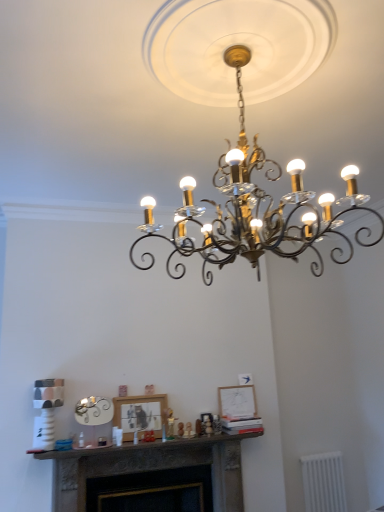
Locate an element on the screen. This screenshot has width=384, height=512. black wrought iron chandelier at center is located at coordinates (252, 206).

This screenshot has width=384, height=512. Describe the element at coordinates (323, 482) in the screenshot. I see `white plastic radiator at lower right` at that location.

What do you see at coordinates (151, 476) in the screenshot? Image resolution: width=384 pixels, height=512 pixels. I see `dark gray stone fireplace at center` at bounding box center [151, 476].

The image size is (384, 512). I want to click on black wrought iron chandelier at center, so click(x=252, y=206).

Is matte white picture frame at center, which ranks as the 2th picture frame in front-to-back order, wider than matte black picture frame at center, marked as the 1th picture frame in a front-to-back arrangement?

In fact, matte white picture frame at center, which ranks as the 2th picture frame in front-to-back order, might be narrower than matte black picture frame at center, marked as the 1th picture frame in a front-to-back arrangement.

Between point (246, 401) and point (150, 415), which one is positioned behind?

The point (246, 401) is farther from the camera.

Could you tell me if matte white picture frame at center, which ranks as the 2th picture frame in front-to-back order, is turned towards matte black picture frame at center, positioned as the second picture frame in back-to-front order?

No, matte white picture frame at center, which ranks as the 2th picture frame in front-to-back order, does not turn towards matte black picture frame at center, positioned as the second picture frame in back-to-front order.

Is point (315, 480) behind point (224, 463)?

That is True.

Is white plastic radiator at lower right facing towards dark gray stone fireplace at center?

No, white plastic radiator at lower right is not aimed at dark gray stone fireplace at center.

Are white plastic radiator at lower right and dark gray stone fireplace at center making contact?

No, white plastic radiator at lower right is not beside dark gray stone fireplace at center.

From the image's perspective, who appears lower, matte white picture frame at center, which is counted as the 2th picture frame, starting from the left, or black wrought iron chandelier at center?

From the image's view, matte white picture frame at center, which is counted as the 2th picture frame, starting from the left, is below.

Which object is wider, matte white picture frame at center, placed as the 1th picture frame when sorted from back to front, or black wrought iron chandelier at center?

With larger width is black wrought iron chandelier at center.

Between matte white picture frame at center, which ranks as the 2th picture frame in front-to-back order, and black wrought iron chandelier at center, which one has less height?

Standing shorter between the two is matte white picture frame at center, which ranks as the 2th picture frame in front-to-back order.

Considering the sizes of matte black picture frame at center, positioned as the second picture frame in back-to-front order, and dark gray stone fireplace at center in the image, is matte black picture frame at center, positioned as the second picture frame in back-to-front order, wider or thinner than dark gray stone fireplace at center?

Clearly, matte black picture frame at center, positioned as the second picture frame in back-to-front order, has less width compared to dark gray stone fireplace at center.

Which object is positioned more to the left, matte black picture frame at center, positioned as the second picture frame in back-to-front order, or dark gray stone fireplace at center?

Positioned to the left is matte black picture frame at center, positioned as the second picture frame in back-to-front order.

This screenshot has height=512, width=384. Identify the location of fireplace below the matte black picture frame at center, the 1th picture frame positioned from the left (from the image's perspective). (151, 476).

Locate an element on the screen. Image resolution: width=384 pixels, height=512 pixels. the 1st picture frame above the white plastic radiator at lower right (from the image's perspective) is located at coordinates (140, 414).

Is matte black picture frame at center, positioned as the second picture frame in back-to-front order, not near white plastic radiator at lower right?

Yes, matte black picture frame at center, positioned as the second picture frame in back-to-front order, and white plastic radiator at lower right are quite far apart.

Considering the sizes of objects matte black picture frame at center, the 1th picture frame positioned from the left, and white plastic radiator at lower right in the image provided, who is wider, matte black picture frame at center, the 1th picture frame positioned from the left, or white plastic radiator at lower right?

matte black picture frame at center, the 1th picture frame positioned from the left.

Considering the sizes of objects matte black picture frame at center, positioned as the second picture frame in back-to-front order, and white plastic radiator at lower right in the image provided, who is shorter, matte black picture frame at center, positioned as the second picture frame in back-to-front order, or white plastic radiator at lower right?

Standing shorter between the two is matte black picture frame at center, positioned as the second picture frame in back-to-front order.

Is white plastic radiator at lower right situated inside matte white picture frame at center, placed as the 1th picture frame when sorted from back to front, or outside?

white plastic radiator at lower right is not enclosed by matte white picture frame at center, placed as the 1th picture frame when sorted from back to front.

Which of these two, white plastic radiator at lower right or matte white picture frame at center, which appears as the 1th picture frame when viewed from the right, is smaller?

With smaller size is matte white picture frame at center, which appears as the 1th picture frame when viewed from the right.

Which is more distant, [330,473] or [240,418]?

Point [330,473]

Considering the positions of objects white plastic radiator at lower right and matte white picture frame at center, placed as the 1th picture frame when sorted from back to front, in the image provided, who is in front, white plastic radiator at lower right or matte white picture frame at center, placed as the 1th picture frame when sorted from back to front,?

Positioned in front is matte white picture frame at center, placed as the 1th picture frame when sorted from back to front.

Is dark gray stone fireplace at center looking in the opposite direction of matte black picture frame at center, marked as the 1th picture frame in a front-to-back arrangement?

That's not correct — dark gray stone fireplace at center is not looking away from matte black picture frame at center, marked as the 1th picture frame in a front-to-back arrangement.

From the image's perspective, is dark gray stone fireplace at center below matte black picture frame at center, the 1th picture frame positioned from the left?

Yes.

Which of these two, dark gray stone fireplace at center or matte black picture frame at center, positioned as the second picture frame in back-to-front order, is bigger?

dark gray stone fireplace at center.

Is dark gray stone fireplace at center next to matte black picture frame at center, positioned as the second picture frame in back-to-front order?

No.

Where is `picture frame lying on the right of matte black picture frame at center, the 1th picture frame positioned from the left`? The width and height of the screenshot is (384, 512). picture frame lying on the right of matte black picture frame at center, the 1th picture frame positioned from the left is located at coordinates (237, 402).

At what (x,y) coordinates should I click in order to perform the action: click on fireplace on the left of the white plastic radiator at lower right. Please return your answer as a coordinate pair (x, y). This screenshot has height=512, width=384. Looking at the image, I should click on (151, 476).

Which object lies nearer to the anchor point matte white picture frame at center, which appears as the 1th picture frame when viewed from the right, dark gray stone fireplace at center or matte black picture frame at center, positioned as the second picture frame in back-to-front order?

Among the two, matte black picture frame at center, positioned as the second picture frame in back-to-front order, is located nearer to matte white picture frame at center, which appears as the 1th picture frame when viewed from the right.

Looking at the image, which one is located closer to matte white picture frame at center, which appears as the 1th picture frame when viewed from the right, dark gray stone fireplace at center or black wrought iron chandelier at center?

dark gray stone fireplace at center is closer to matte white picture frame at center, which appears as the 1th picture frame when viewed from the right.

From the picture: Based on their spatial positions, is white plastic radiator at lower right or matte black picture frame at center, marked as the 1th picture frame in a front-to-back arrangement, closer to black wrought iron chandelier at center?

matte black picture frame at center, marked as the 1th picture frame in a front-to-back arrangement, is positioned closer to the anchor black wrought iron chandelier at center.

In the scene shown: From the image, which object appears to be farther from matte black picture frame at center, the 1th picture frame positioned from the left, matte white picture frame at center, which ranks as the 2th picture frame in front-to-back order, or white plastic radiator at lower right?

white plastic radiator at lower right is positioned further to the anchor matte black picture frame at center, the 1th picture frame positioned from the left.

Looking at the image, which one is located closer to black wrought iron chandelier at center, matte white picture frame at center, placed as the 1th picture frame when sorted from back to front, or white plastic radiator at lower right?

matte white picture frame at center, placed as the 1th picture frame when sorted from back to front, lies closer to black wrought iron chandelier at center than the other object.

Looking at the image, which one is located closer to matte black picture frame at center, marked as the 1th picture frame in a front-to-back arrangement, white plastic radiator at lower right or black wrought iron chandelier at center?

Among the two, white plastic radiator at lower right is located nearer to matte black picture frame at center, marked as the 1th picture frame in a front-to-back arrangement.

Estimate the real-world distances between objects in this image. Which object is closer to dark gray stone fireplace at center, matte white picture frame at center, placed as the 1th picture frame when sorted from back to front, or white plastic radiator at lower right?

matte white picture frame at center, placed as the 1th picture frame when sorted from back to front.

Which object lies nearer to the anchor point black wrought iron chandelier at center, matte white picture frame at center, which ranks as the 2th picture frame in front-to-back order, or matte black picture frame at center, the 1th picture frame positioned from the left?

matte black picture frame at center, the 1th picture frame positioned from the left, lies closer to black wrought iron chandelier at center than the other object.

Locate an element on the screen. This screenshot has width=384, height=512. fireplace between matte black picture frame at center, positioned as the second picture frame in back-to-front order, and matte white picture frame at center, which is counted as the 2th picture frame, starting from the left is located at coordinates (151, 476).

Locate an element on the screen. fireplace between black wrought iron chandelier at center and white plastic radiator at lower right along the z-axis is located at coordinates (151, 476).

At what (x,y) coordinates should I click in order to perform the action: click on picture frame between dark gray stone fireplace at center and white plastic radiator at lower right. Please return your answer as a coordinate pair (x, y). Looking at the image, I should click on (237, 402).

Identify the location of fireplace between matte black picture frame at center, positioned as the second picture frame in back-to-front order, and white plastic radiator at lower right. The image size is (384, 512). (151, 476).